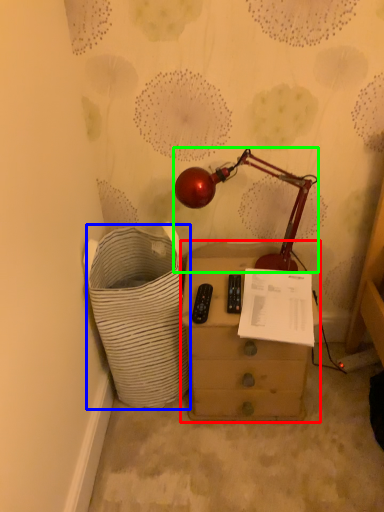
Question: Estimate the real-world distances between objects in this image. Which object is farther from chest of drawers (highlighted by a red box), laundry basket (highlighted by a blue box) or lamp (highlighted by a green box)?

Choices:
 (A) laundry basket
 (B) lamp

Answer: (B)